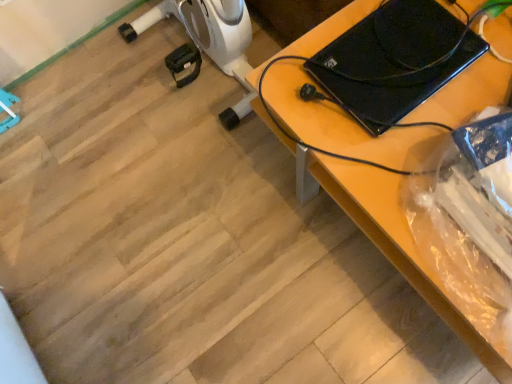
Question: In terms of width, does black glossy laptop at upper right look wider or thinner when compared to black plastic laptop at upper right?

Choices:
 (A) thin
 (B) wide

Answer: (A)

Question: From the image's perspective, is black glossy laptop at upper right above or below black plastic laptop at upper right?

Choices:
 (A) below
 (B) above

Answer: (B)

Question: Considering their positions, is black glossy laptop at upper right located in front of or behind black plastic laptop at upper right?

Choices:
 (A) behind
 (B) front

Answer: (A)

Question: In terms of height, does black plastic laptop at upper right look taller or shorter compared to black glossy laptop at upper right?

Choices:
 (A) short
 (B) tall

Answer: (B)

Question: From the image's perspective, is black plastic laptop at upper right positioned above or below black glossy laptop at upper right?

Choices:
 (A) above
 (B) below

Answer: (B)

Question: Does point (317, 145) appear closer or farther from the camera than point (378, 11)?

Choices:
 (A) closer
 (B) farther

Answer: (A)

Question: Is black plastic laptop at upper right to the left or to the right of black glossy laptop at upper right in the image?

Choices:
 (A) right
 (B) left

Answer: (A)